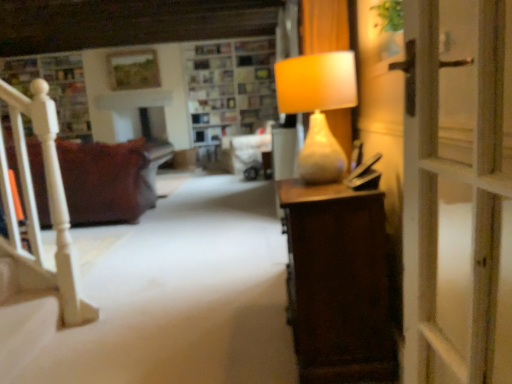
The image size is (512, 384). What are the coordinates of `wooden shelves at upper center` in the screenshot? It's located at (229, 90).

Measure the distance between point (x=345, y=67) and camera.

Point (x=345, y=67) and camera are 5.11 feet apart.

The height and width of the screenshot is (384, 512). What are the coordinates of `wooden shelves at upper center` in the screenshot? It's located at (229, 90).

Is wooden shelves at upper center thinner than brown fabric couch at left?

Yes.

Is wooden shelves at upper center positioned with its back to brown fabric couch at left?

No, wooden shelves at upper center is not facing away from brown fabric couch at left.

From a real-world perspective, is wooden shelves at upper center positioned above or below brown fabric couch at left?

wooden shelves at upper center is above brown fabric couch at left.

Which is more to the left, matte beige lamp at right or wooden shelves at upper center?

Positioned to the left is wooden shelves at upper center.

Do you think matte beige lamp at right is within wooden shelves at upper center, or outside of it?

matte beige lamp at right is spatially situated outside wooden shelves at upper center.

How different are the orientations of matte beige lamp at right and wooden shelves at upper center in degrees?

90.8 degrees separate the facing orientations of matte beige lamp at right and wooden shelves at upper center.

From the image's perspective, is matte beige lamp at right above or below wooden shelves at upper center?

Based on their image positions, matte beige lamp at right is located beneath wooden shelves at upper center.

What's the angular difference between brown fabric couch at left and wooden shelves at upper center's facing directions?

The angular difference between brown fabric couch at left and wooden shelves at upper center is 180 degrees.

Considering the points (136, 152) and (194, 119), which point is in front, point (136, 152) or point (194, 119)?

The point (136, 152) is closer to the camera.

From the image's perspective, does brown fabric couch at left appear lower than wooden shelves at upper center?

Yes, from the image's perspective, brown fabric couch at left is beneath wooden shelves at upper center.

Identify the location of studio couch beneath the wooden shelves at upper center (from a real-world perspective). (105, 181).

Which is nearer, (72,163) or (316,109)?

The point (316,109) is closer to the camera.

From the picture: Is brown fabric couch at left located outside matte beige lamp at right?

brown fabric couch at left lies outside matte beige lamp at right's area.

Which of these two, brown fabric couch at left or matte beige lamp at right, is smaller?

matte beige lamp at right.

Which object is closer to the camera taking this photo, brown fabric couch at left or matte beige lamp at right?

matte beige lamp at right is more forward.

Is wooden shelves at upper center thinner than matte beige lamp at right?

No.

Image resolution: width=512 pixels, height=384 pixels. In order to click on lamp on the right of wooden shelves at upper center in this screenshot , I will do `click(318, 108)`.

From a real-world perspective, is wooden shelves at upper center physically below matte beige lamp at right?

Incorrect, from a real-world perspective, wooden shelves at upper center is higher than matte beige lamp at right.

Is wooden shelves at upper center in front of or behind matte beige lamp at right in the image?

In the image, wooden shelves at upper center appears behind matte beige lamp at right.

I want to click on lamp that is on the right side of brown fabric couch at left, so click(318, 108).

Considering the sizes of objects matte beige lamp at right and brown fabric couch at left in the image provided, who is shorter, matte beige lamp at right or brown fabric couch at left?

Standing shorter between the two is matte beige lamp at right.

What's the angular difference between matte beige lamp at right and brown fabric couch at left's facing directions?

There is a 89.3-degree angle between the facing directions of matte beige lamp at right and brown fabric couch at left.

At what (x,y) coordinates should I click in order to perform the action: click on shelf on the right side of brown fabric couch at left. Please return your answer as a coordinate pair (x, y). The height and width of the screenshot is (384, 512). Looking at the image, I should click on (229, 90).

Where is `shelf located on the left of matte beige lamp at right`? The image size is (512, 384). shelf located on the left of matte beige lamp at right is located at coordinates (229, 90).

Based on their spatial positions, is brown fabric couch at left or matte beige lamp at right further from wooden shelves at upper center?

matte beige lamp at right is further to wooden shelves at upper center.

Based on the photo, estimate the real-world distances between objects in this image. Which object is further from matte beige lamp at right, wooden shelves at upper center or brown fabric couch at left?

wooden shelves at upper center.

When comparing their distances from brown fabric couch at left, does wooden shelves at upper center or matte beige lamp at right seem further?

Based on the image, matte beige lamp at right appears to be further to brown fabric couch at left.

Looking at this image, looking at the image, which one is located further to matte beige lamp at right, brown fabric couch at left or wooden shelves at upper center?

wooden shelves at upper center is positioned further to the anchor matte beige lamp at right.

Based on their spatial positions, is matte beige lamp at right or brown fabric couch at left further from wooden shelves at upper center?

matte beige lamp at right is further to wooden shelves at upper center.

Based on their spatial positions, is matte beige lamp at right or wooden shelves at upper center further from brown fabric couch at left?

matte beige lamp at right is positioned further to the anchor brown fabric couch at left.

At what (x,y) coordinates should I click in order to perform the action: click on studio couch located between matte beige lamp at right and wooden shelves at upper center in the depth direction. Please return your answer as a coordinate pair (x, y). Looking at the image, I should click on (105, 181).